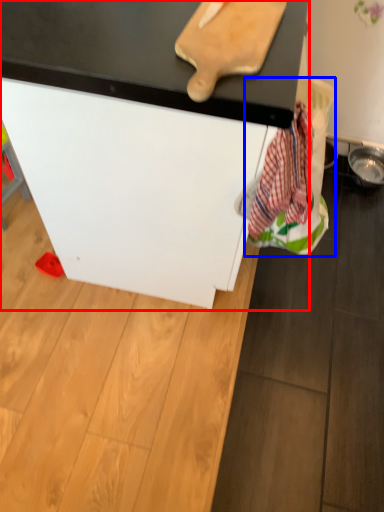
Question: Among these objects, which one is farthest to the camera, furniture (highlighted by a red box) or laundry (highlighted by a blue box)?

Choices:
 (A) furniture
 (B) laundry

Answer: (B)